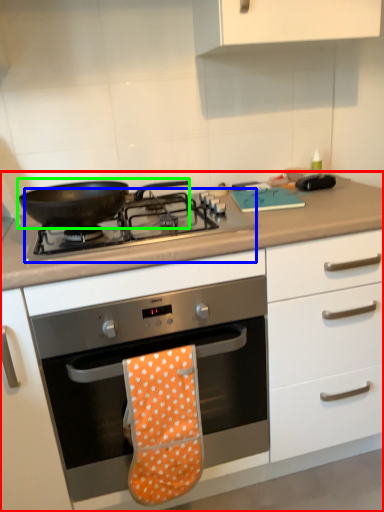
Question: Considering the real-world distances, which object is farthest from cabinetry (highlighted by a red box)? gas stove (highlighted by a blue box) or kitchen appliance (highlighted by a green box)?

Choices:
 (A) gas stove
 (B) kitchen appliance

Answer: (B)